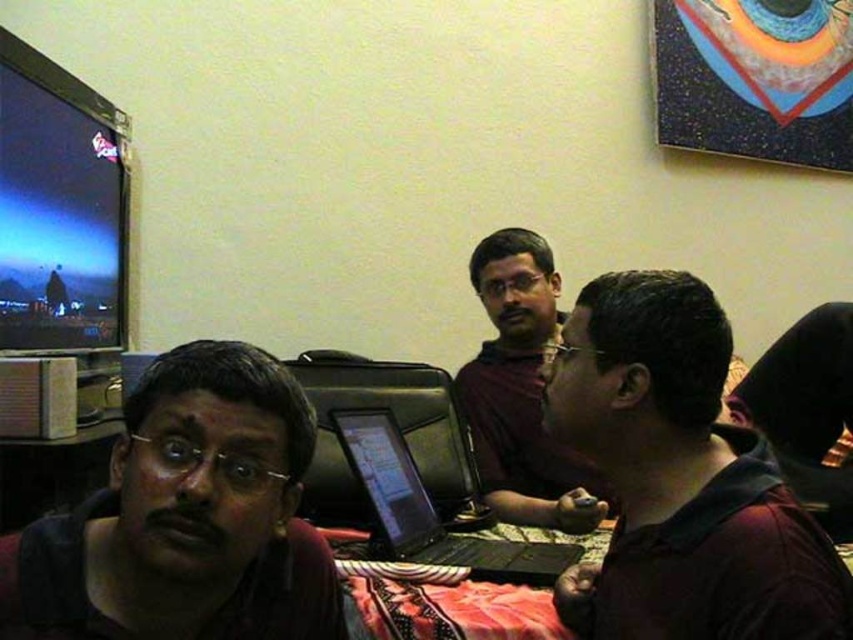
You are a person standing in the room and want to see both the shiny black monitor at upper left and the matte brown shirt at center. Which object is closer to your eye level?

The matte brown shirt at center is taller than the shiny black monitor at upper left, so the matte brown shirt at center is closer to your eye level.

You are a photographer setting up for a group photo. You need to ensure that the matte black shirt at left and the shiny black monitor at upper left are both visible in the frame. Given their sizes, which object should you prioritize positioning closer to the camera to maintain clarity?

The matte black shirt at left is larger in width than the shiny black monitor at upper left, so you should prioritize positioning the matte black shirt at left closer to the camera to maintain clarity.